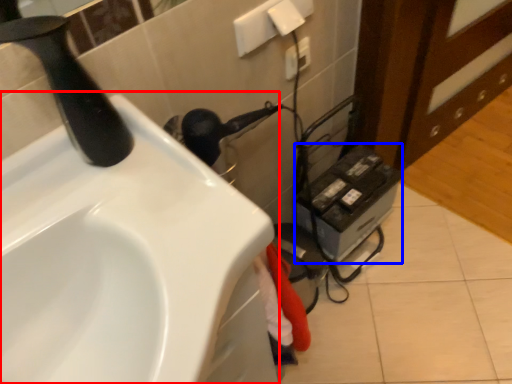
Question: Which object appears closest to the camera in this image, sink (highlighted by a red box) or appliance (highlighted by a blue box)?

Choices:
 (A) sink
 (B) appliance

Answer: (A)